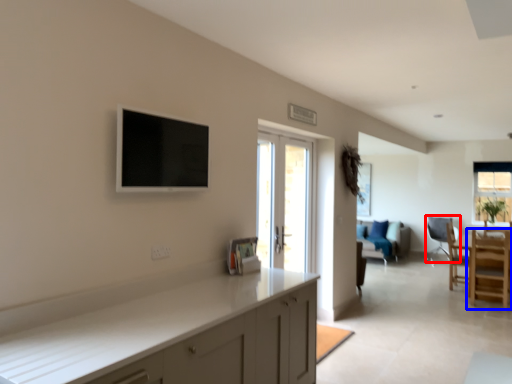
Question: Among these objects, which one is farthest to the camera, chair (highlighted by a red box) or chair (highlighted by a blue box)?

Choices:
 (A) chair
 (B) chair

Answer: (A)